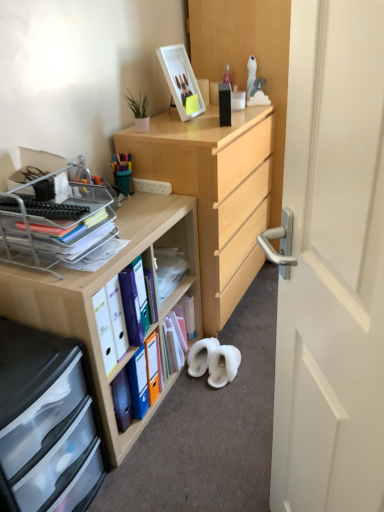
Measure the distance between wooden desk at center and camera.

wooden desk at center is 1.22 meters from camera.

What do you see at coordinates (181, 81) in the screenshot?
I see `white glossy picture frame at upper center` at bounding box center [181, 81].

The height and width of the screenshot is (512, 384). Find the location of `white glossy picture frame at upper center`. white glossy picture frame at upper center is located at coordinates (181, 81).

In order to face multicolored plastic pen holder at upper left, should I rotate leftwards or rightwards?

Turn left approximately 9.477 degrees to face it.

Identify the location of multicolored plastic pen holder at upper left. (122, 172).

Locate an element on the screen. This screenshot has width=384, height=512. transparent plastic drawers at lower left is located at coordinates (42, 419).

How different are the orientations of wooden desk at center and multicolored plastic pen holder at upper left in degrees?

3.6 degrees separate the facing orientations of wooden desk at center and multicolored plastic pen holder at upper left.

Is wooden desk at center aimed at multicolored plastic pen holder at upper left?

No, wooden desk at center is not facing towards multicolored plastic pen holder at upper left.

Is wooden desk at center inside or outside of multicolored plastic pen holder at upper left?

wooden desk at center exists outside the volume of multicolored plastic pen holder at upper left.

Considering the sizes of objects wooden desk at center and multicolored plastic pen holder at upper left in the image provided, who is bigger, wooden desk at center or multicolored plastic pen holder at upper left?

wooden desk at center.

How many degrees apart are the facing directions of transparent plastic drawers at lower left and white glossy picture frame at upper center?

The angle between the facing direction of transparent plastic drawers at lower left and the facing direction of white glossy picture frame at upper center is 4.03 degrees.

Considering the relative sizes of transparent plastic drawers at lower left and white glossy picture frame at upper center in the image provided, is transparent plastic drawers at lower left smaller than white glossy picture frame at upper center?

No, transparent plastic drawers at lower left is not smaller than white glossy picture frame at upper center.

Is transparent plastic drawers at lower left shorter than white glossy picture frame at upper center?

No.

Between transparent plastic drawers at lower left and white glossy picture frame at upper center, which one is positioned behind?

white glossy picture frame at upper center is more distant.

Is white glossy picture frame at upper center to the left or to the right of multicolored plastic pen holder at upper left in the image?

white glossy picture frame at upper center is to the right of multicolored plastic pen holder at upper left.

Image resolution: width=384 pixels, height=512 pixels. I want to click on picture frame above the multicolored plastic pen holder at upper left (from the image's perspective), so click(181, 81).

From the image's perspective, would you say white glossy picture frame at upper center is shown under multicolored plastic pen holder at upper left?

Incorrect, from the image's perspective, white glossy picture frame at upper center is higher than multicolored plastic pen holder at upper left.

Consider the image. Is white glossy picture frame at upper center next to multicolored plastic pen holder at upper left and touching it?

No, white glossy picture frame at upper center is not with multicolored plastic pen holder at upper left.

Is white glossy picture frame at upper center further to camera compared to wooden desk at center?

Yes, white glossy picture frame at upper center is further from the camera.

Which is more to the left, white glossy picture frame at upper center or wooden desk at center?

From the viewer's perspective, wooden desk at center appears more on the left side.

Is white glossy picture frame at upper center oriented away from wooden desk at center?

No, white glossy picture frame at upper center is not facing away from wooden desk at center.

From the image's perspective, is white glossy picture frame at upper center above or below wooden desk at center?

Based on their image positions, white glossy picture frame at upper center is located above wooden desk at center.

From the image's perspective, is multicolored plastic pen holder at upper left beneath white glossy picture frame at upper center?

Indeed, from the image's perspective, multicolored plastic pen holder at upper left is shown beneath white glossy picture frame at upper center.

Considering the relative sizes of multicolored plastic pen holder at upper left and white glossy picture frame at upper center in the image provided, is multicolored plastic pen holder at upper left bigger than white glossy picture frame at upper center?

No.

Is multicolored plastic pen holder at upper left positioned with its back to white glossy picture frame at upper center?

No.

Is multicolored plastic pen holder at upper left inside the boundaries of wooden desk at center, or outside?

multicolored plastic pen holder at upper left is not enclosed by wooden desk at center.

Which of these two, multicolored plastic pen holder at upper left or wooden desk at center, stands shorter?

multicolored plastic pen holder at upper left is shorter.

Where is `stationery on the left of wooden desk at center`? The image size is (384, 512). stationery on the left of wooden desk at center is located at coordinates (122, 172).

Is multicolored plastic pen holder at upper left in front of or behind wooden desk at center in the image?

multicolored plastic pen holder at upper left is positioned farther from the viewer than wooden desk at center.

In the scene shown: Which of these two, wooden desk at center or transparent plastic drawers at lower left, is bigger?

Bigger between the two is wooden desk at center.

Considering the relative sizes of wooden desk at center and transparent plastic drawers at lower left in the image provided, is wooden desk at center taller than transparent plastic drawers at lower left?

Correct, wooden desk at center is much taller as transparent plastic drawers at lower left.

Do you think wooden desk at center is within transparent plastic drawers at lower left, or outside of it?

wooden desk at center is not enclosed by transparent plastic drawers at lower left.

How many degrees apart are the facing directions of wooden desk at center and transparent plastic drawers at lower left?

wooden desk at center and transparent plastic drawers at lower left are facing 2.04 degrees away from each other.

The width and height of the screenshot is (384, 512). Find the location of `desk on the right of multicolored plastic pen holder at upper left`. desk on the right of multicolored plastic pen holder at upper left is located at coordinates (103, 286).

This screenshot has height=512, width=384. I want to click on picture frame that appears above the transparent plastic drawers at lower left (from the image's perspective), so click(181, 81).

Based on their spatial positions, is wooden desk at center or transparent plastic drawers at lower left closer to multicolored plastic pen holder at upper left?

Among the two, wooden desk at center is located nearer to multicolored plastic pen holder at upper left.

Considering their positions, is white glossy picture frame at upper center positioned further to wooden desk at center than multicolored plastic pen holder at upper left?

white glossy picture frame at upper center lies further to wooden desk at center than the other object.

Estimate the real-world distances between objects in this image. Which object is further from white glossy picture frame at upper center, wooden desk at center or multicolored plastic pen holder at upper left?

Among the two, wooden desk at center is located further to white glossy picture frame at upper center.

Looking at the image, which one is located closer to white glossy picture frame at upper center, transparent plastic drawers at lower left or multicolored plastic pen holder at upper left?

multicolored plastic pen holder at upper left is positioned closer to the anchor white glossy picture frame at upper center.

When comparing their distances from multicolored plastic pen holder at upper left, does white glossy picture frame at upper center or wooden desk at center seem closer?

Based on the image, white glossy picture frame at upper center appears to be nearer to multicolored plastic pen holder at upper left.

Looking at this image, based on their spatial positions, is multicolored plastic pen holder at upper left or wooden desk at center closer to transparent plastic drawers at lower left?

wooden desk at center is positioned closer to the anchor transparent plastic drawers at lower left.

When comparing their distances from white glossy picture frame at upper center, does transparent plastic drawers at lower left or wooden desk at center seem closer?

wooden desk at center is closer to white glossy picture frame at upper center.

Considering their positions, is multicolored plastic pen holder at upper left positioned further to wooden desk at center than white glossy picture frame at upper center?

Among the two, white glossy picture frame at upper center is located further to wooden desk at center.

The image size is (384, 512). What are the coordinates of `desk between multicolored plastic pen holder at upper left and transparent plastic drawers at lower left vertically` in the screenshot? It's located at (103, 286).

This screenshot has width=384, height=512. In order to click on stationery between white glossy picture frame at upper center and wooden desk at center in the vertical direction in this screenshot , I will do `click(122, 172)`.

Where is `stationery between white glossy picture frame at upper center and transparent plastic drawers at lower left vertically`? The height and width of the screenshot is (512, 384). stationery between white glossy picture frame at upper center and transparent plastic drawers at lower left vertically is located at coordinates point(122,172).

Where is `desk between white glossy picture frame at upper center and transparent plastic drawers at lower left in the vertical direction`? Image resolution: width=384 pixels, height=512 pixels. desk between white glossy picture frame at upper center and transparent plastic drawers at lower left in the vertical direction is located at coordinates (103, 286).